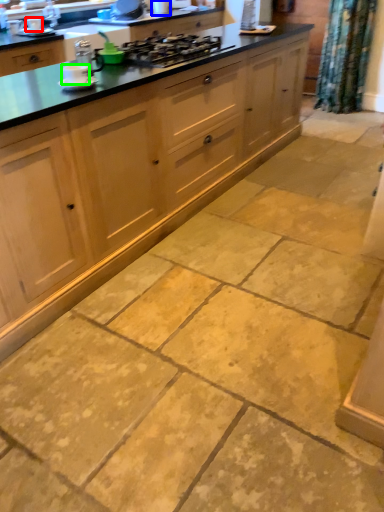
Question: Which object is positioned farthest from appliance (highlighted by a red box)? Select from appliance (highlighted by a blue box) and appliance (highlighted by a green box).

Choices:
 (A) appliance
 (B) appliance

Answer: (B)